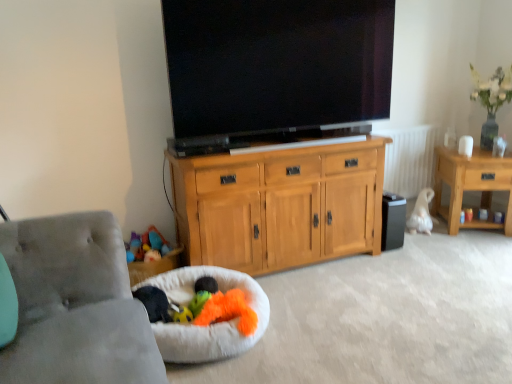
The image size is (512, 384). I want to click on empty space that is to the right of white fluffy dog bed at lower left, so click(319, 322).